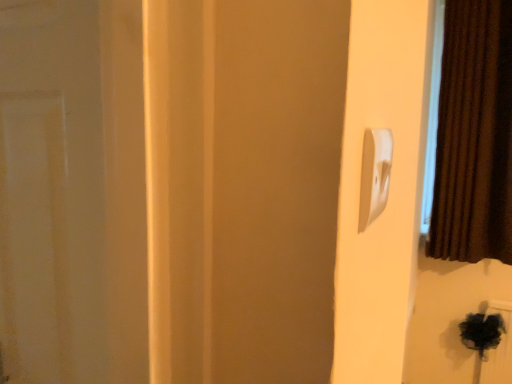
Question: Does white plastic light switch at upper right have a greater width compared to brown velvet curtain at right?

Choices:
 (A) yes
 (B) no

Answer: (B)

Question: Can you confirm if white plastic light switch at upper right is shorter than brown velvet curtain at right?

Choices:
 (A) no
 (B) yes

Answer: (B)

Question: Is white plastic light switch at upper right bigger than brown velvet curtain at right?

Choices:
 (A) no
 (B) yes

Answer: (A)

Question: From the image's perspective, is white plastic light switch at upper right under brown velvet curtain at right?

Choices:
 (A) yes
 (B) no

Answer: (A)

Question: Does white plastic light switch at upper right come behind brown velvet curtain at right?

Choices:
 (A) no
 (B) yes

Answer: (A)

Question: Is white plastic light switch at upper right facing away from brown velvet curtain at right?

Choices:
 (A) yes
 (B) no

Answer: (B)

Question: Can you confirm if brown velvet curtain at right is taller than white plastic light switch at upper right?

Choices:
 (A) no
 (B) yes

Answer: (B)

Question: Is brown velvet curtain at right looking in the opposite direction of white plastic light switch at upper right?

Choices:
 (A) no
 (B) yes

Answer: (A)

Question: Considering the relative positions of brown velvet curtain at right and white plastic light switch at upper right in the image provided, is brown velvet curtain at right to the right of white plastic light switch at upper right from the viewer's perspective?

Choices:
 (A) no
 (B) yes

Answer: (B)

Question: Is brown velvet curtain at right at the left side of white plastic light switch at upper right?

Choices:
 (A) no
 (B) yes

Answer: (A)

Question: Is brown velvet curtain at right thinner than white plastic light switch at upper right?

Choices:
 (A) yes
 (B) no

Answer: (B)

Question: Is brown velvet curtain at right smaller than white plastic light switch at upper right?

Choices:
 (A) no
 (B) yes

Answer: (A)

Question: From a real-world perspective, relative to white plastic light switch at upper right, is brown velvet curtain at right vertically above or below?

Choices:
 (A) above
 (B) below

Answer: (A)